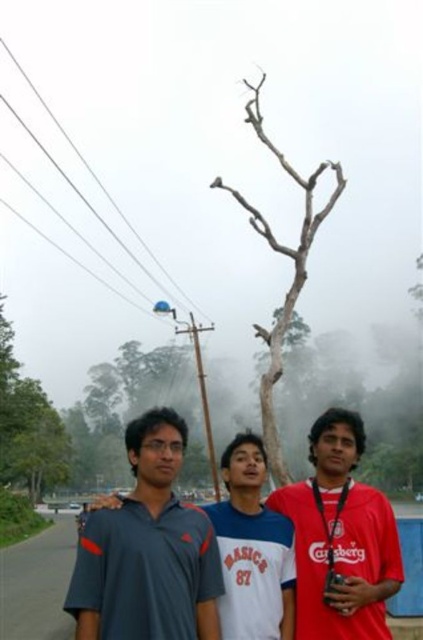
Who is more distant from viewer, (x=331, y=406) or (x=274, y=524)?

Positioned behind is point (x=331, y=406).

Is point (359, 484) farther from camera compared to point (227, 564)?

Yes, it is behind point (227, 564).

Does point (315, 625) lie behind point (236, 490)?

No, it is not.

Where is `red matte shirt at center`? red matte shirt at center is located at coordinates (340, 538).

Is matte gray shirt at center further to the viewer compared to white cotton shirt at center?

No, matte gray shirt at center is in front of white cotton shirt at center.

Does matte gray shirt at center have a greater height compared to white cotton shirt at center?

Yes, matte gray shirt at center is taller than white cotton shirt at center.

I want to click on matte gray shirt at center, so [148, 550].

This screenshot has height=640, width=423. I want to click on matte gray shirt at center, so click(148, 550).

Locate an element on the screen. matte gray shirt at center is located at coordinates [148, 550].

Who is more forward, (96, 544) or (299, 275)?

Point (96, 544)

Does point (197, 616) come in front of point (310, 236)?

Yes, it is.

Find the location of a particular element. matte gray shirt at center is located at coordinates 148,550.